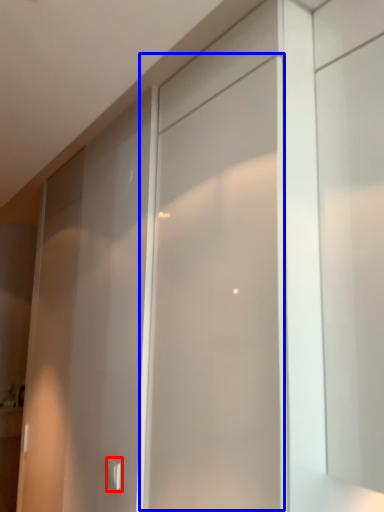
Question: Which object appears farthest to the camera in this image, door handle (highlighted by a red box) or screen door (highlighted by a blue box)?

Choices:
 (A) door handle
 (B) screen door

Answer: (A)